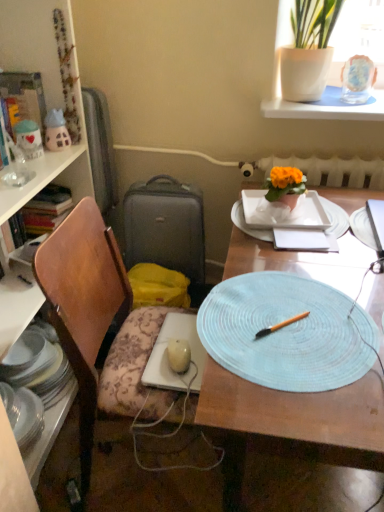
Identify the location of vacant space behind light blue woven placemat at center, the second platter in the right-to-left sequence. The height and width of the screenshot is (512, 384). (295, 248).